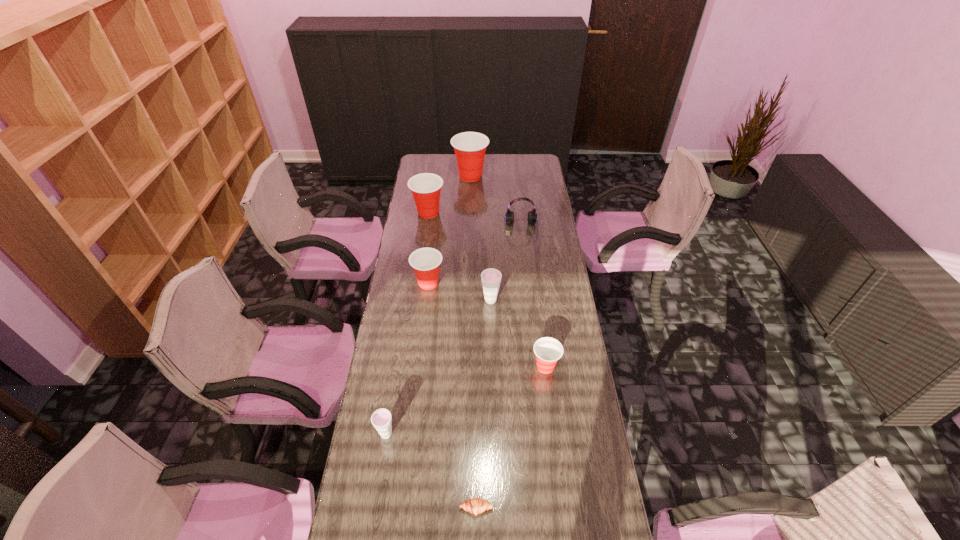
Locate an element on the screen. the nearer purple cup is located at coordinates (381, 419).

Locate an element on the screen. the nearest cup is located at coordinates click(381, 419).

Locate an element on the screen. This screenshot has width=960, height=540. the nearest object is located at coordinates (475, 506).

Locate an element on the screen. The width and height of the screenshot is (960, 540). the shortest object is located at coordinates (475, 506).

This screenshot has height=540, width=960. Identify the location of vacant region located 0.100m on the left of the biggest red cup. (435, 176).

Image resolution: width=960 pixels, height=540 pixels. I want to click on vacant area situated on the front of the second biggest red cup, so click(421, 264).

Identify the location of vacant space located on the ear cushions of the headset. (523, 247).

You are a GUI agent. You are given a task and a screenshot of the screen. Output one action in this format:
    pyautogui.click(x=<x>, y=<y>)
    Task: Click on the vacant area situated on the front of the third biggest red cup
    
    Given the screenshot: What is the action you would take?
    pyautogui.click(x=418, y=377)

Where is `free location located 0.050m on the right of the right purple cup`? The image size is (960, 540). free location located 0.050m on the right of the right purple cup is located at coordinates tap(513, 300).

Locate an element on the screen. Image resolution: width=960 pixels, height=540 pixels. vacant position located 0.350m on the back of the nearest red cup is located at coordinates (536, 287).